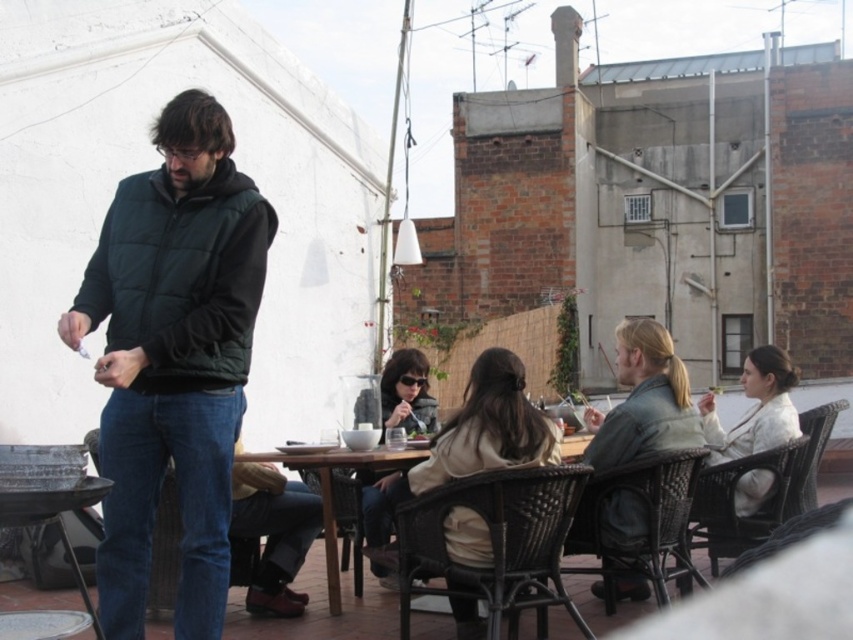
Question: Which point appears closest to the camera in this image?

Choices:
 (A) (167, 596)
 (B) (462, 568)
 (C) (776, 496)
 (D) (471, 609)

Answer: (B)

Question: Which object is closer to the camera taking this photo?

Choices:
 (A) metallic silver grill at lower left
 (B) denim fabric chair at lower left
 (C) matte black vest at left

Answer: (A)

Question: Does light beige sweater at right have a smaller size compared to denim fabric chair at lower left?

Choices:
 (A) no
 (B) yes

Answer: (A)

Question: Does matte black vest at left lie in front of rattan chair at center?

Choices:
 (A) yes
 (B) no

Answer: (B)

Question: Can you confirm if leather jacket at right is positioned to the left of matte black jacket at center?

Choices:
 (A) no
 (B) yes

Answer: (A)

Question: Which of the following is the farthest from the observer?

Choices:
 (A) denim fabric chair at lower left
 (B) brown wooden table at center
 (C) metallic silver grill at lower left

Answer: (A)